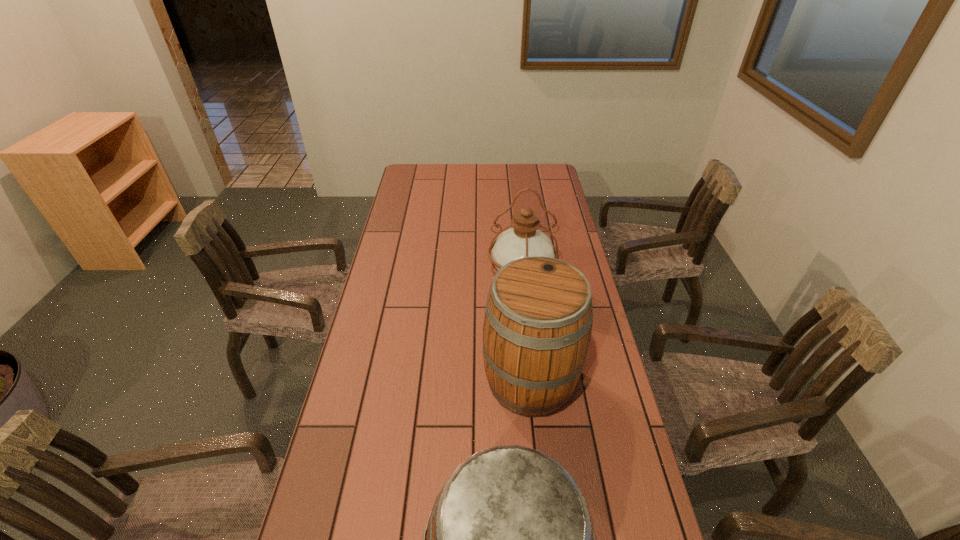
At what (x,y) coordinates should I click in order to perform the action: click on oil lamp. Please return your answer as a coordinate pair (x, y). Looking at the image, I should click on point(524,239).

Locate an element on the screen. This screenshot has width=960, height=540. the farther cider is located at coordinates (538, 319).

Locate an element on the screen. The image size is (960, 540). vacant space located 0.320m on the back of the oil lamp is located at coordinates (514, 211).

The height and width of the screenshot is (540, 960). I want to click on vacant space located on the back of the farther cider, so click(520, 283).

The width and height of the screenshot is (960, 540). I want to click on oil lamp that is at the right edge, so click(524, 239).

The image size is (960, 540). I want to click on cider at the right edge, so click(x=538, y=319).

Where is `vacant space at the far edge of the desktop`? This screenshot has width=960, height=540. vacant space at the far edge of the desktop is located at coordinates (521, 172).

Where is `blank space at the left edge of the desktop`? blank space at the left edge of the desktop is located at coordinates (399, 333).

This screenshot has height=540, width=960. I want to click on free space at the right edge of the desktop, so click(x=629, y=448).

This screenshot has width=960, height=540. Identify the location of blank space at the far left corner of the desktop. (437, 167).